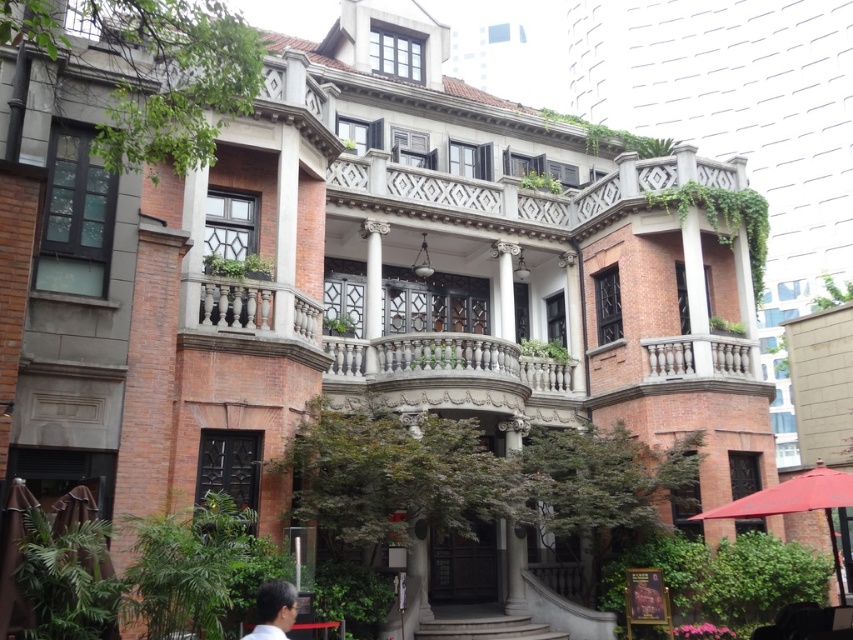
Question: Which object is farther from the camera taking this photo?

Choices:
 (A) white marble column at center
 (B) dark brown hair at lower center

Answer: (A)

Question: Can you confirm if white marble column at center is positioned below dark brown hair at lower center?

Choices:
 (A) no
 (B) yes

Answer: (B)

Question: Observing the image, what is the correct spatial positioning of white marble column at center in reference to dark brown hair at lower center?

Choices:
 (A) below
 (B) above

Answer: (A)

Question: Does white marble column at center have a smaller size compared to dark brown hair at lower center?

Choices:
 (A) no
 (B) yes

Answer: (A)